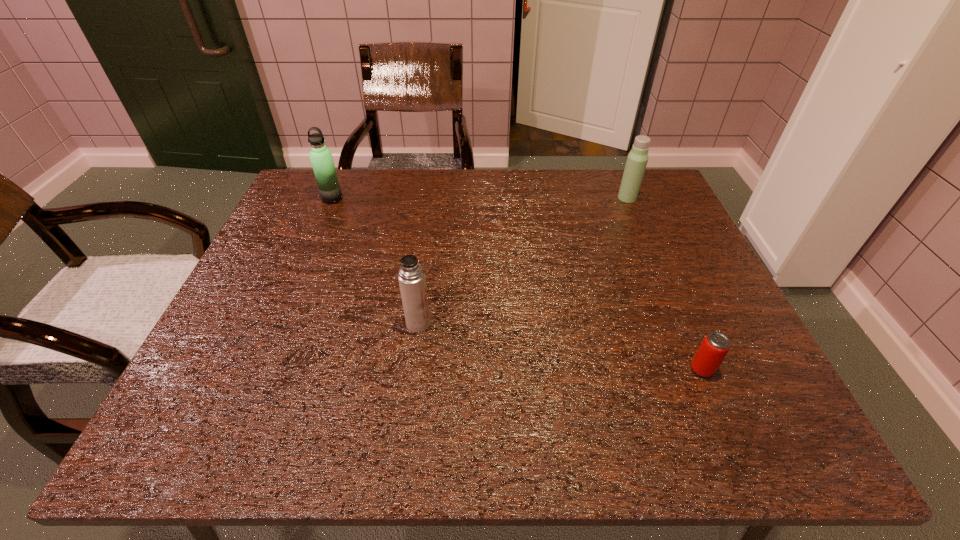
The width and height of the screenshot is (960, 540). I want to click on unoccupied area between the bottle and the tallest object, so click(654, 255).

I want to click on vacant space that's between the third shortest object and the third nearest object, so click(x=654, y=255).

At what (x,y) coordinates should I click in order to perform the action: click on empty location between the bottle and the farthest object. Please return your answer as a coordinate pair (x, y). The width and height of the screenshot is (960, 540). Looking at the image, I should click on (606, 240).

Locate an element on the screen. vacant point located between the octopus and the second object from left to right is located at coordinates (432, 242).

I want to click on free space between the second tallest object and the farthest object, so click(606, 240).

At what (x,y) coordinates should I click in order to perform the action: click on object that is the second closest one to the farthest object. Please return your answer as a coordinate pair (x, y). This screenshot has height=540, width=960. Looking at the image, I should click on (411, 276).

Select which object is the closest to the bottle. Please provide its 2D coordinates. Your answer should be formatted as a tuple, i.e. [(x, y)], where the tuple contains the x and y coordinates of a point satisfying the conditions above.

[(709, 356)]

Identify the location of free point that satisfies the following two spatial constraints: 1. on the front side of the second tallest object; 2. on the right side of the duckling. (562, 308).